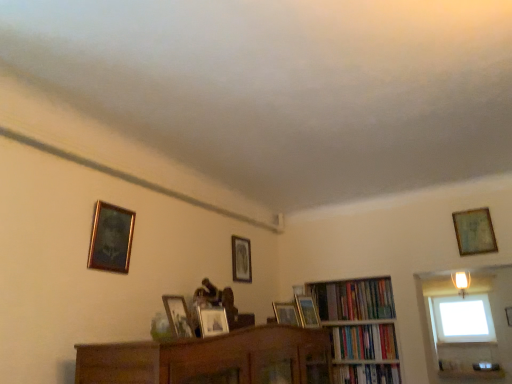
Question: From a real-world perspective, relative to gold-framed painting at upper left, the sixth picture frame viewed from the right, is hardcover book at center-right, acting as the 1th book starting from the bottom, vertically above or below?

Choices:
 (A) above
 (B) below

Answer: (B)

Question: In terms of size, does hardcover book at center-right, which ranks as the 3th book in top-to-bottom order, appear bigger or smaller than gold-framed painting at upper left, marked as the first picture frame in a left-to-right arrangement?

Choices:
 (A) small
 (B) big

Answer: (B)

Question: Which is nearer to the gold-framed picture at center, positioned as the 6th picture frame in front-to-back order?

Choices:
 (A) gold-framed painting at upper left, the sixth picture frame viewed from the right
 (B) wooden picture frame at center, positioned as the fourth picture frame in back-to-front order
 (C) hardcover book at center-right, which ranks as the 3th book in top-to-bottom order
 (D) wooden bookcase at center
 (E) transparent glass window at upper right

Answer: (B)

Question: Which of these objects is positioned closest to the transparent glass window at upper right?

Choices:
 (A) wooden photo frame at center, which is counted as the fifth picture frame, starting from the right
 (B) wooden picture frame at upper right, the 5th picture frame viewed from the front
 (C) gold-framed picture at center, positioned as the 6th picture frame in front-to-back order
 (D) wooden picture frame at upper center, the 4th picture frame positioned from the front
 (E) wooden picture frame at center, which ranks as the 3th picture frame in right-to-left order

Answer: (B)